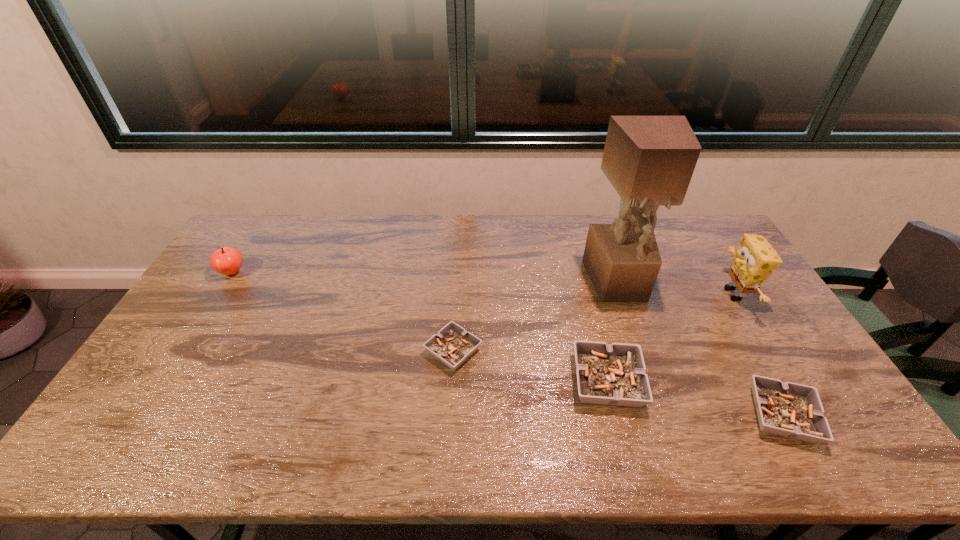
The image size is (960, 540). Find the location of `the shortest object`. the shortest object is located at coordinates (452, 345).

Locate an element on the screen. This screenshot has width=960, height=540. the second object from left to right is located at coordinates (452, 345).

Where is `the second ashtray from left to right`? The height and width of the screenshot is (540, 960). the second ashtray from left to right is located at coordinates [x=614, y=374].

At what (x,y) coordinates should I click in order to perform the action: click on the fourth tallest object. Please return your answer as a coordinate pair (x, y). Looking at the image, I should click on (614, 374).

I want to click on the fifth tallest object, so click(792, 410).

At what (x,y) coordinates should I click in order to perform the action: click on the second tallest ashtray. Please return your answer as a coordinate pair (x, y). This screenshot has height=540, width=960. Looking at the image, I should click on (792, 410).

Image resolution: width=960 pixels, height=540 pixels. In order to click on the fifth shortest object in this screenshot , I will do `click(755, 259)`.

Where is `the tallest object`? the tallest object is located at coordinates (649, 160).

You are a GUI agent. You are given a task and a screenshot of the screen. Output one action in this format:
    pyautogui.click(x=<x>, y=<y>)
    Task: Click on the leftmost object
    The width and height of the screenshot is (960, 540).
    Given the screenshot: What is the action you would take?
    pyautogui.click(x=227, y=260)

What are the coordinates of `the third tallest object` in the screenshot? It's located at (227, 260).